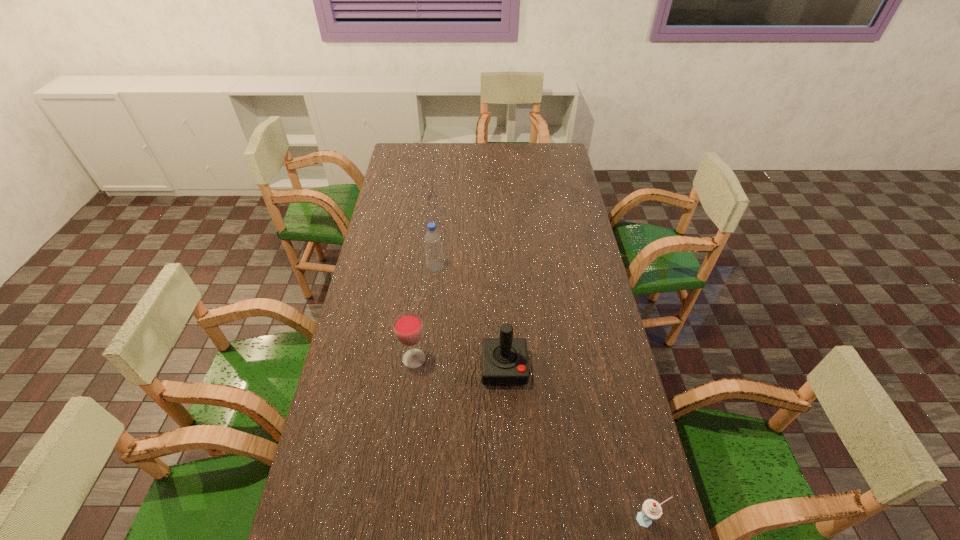
This screenshot has height=540, width=960. In order to click on vacant space at the left edge of the desktop in this screenshot , I will do coord(411,186).

In the image, there is a desktop. Where is `vacant region at the right edge`? Image resolution: width=960 pixels, height=540 pixels. vacant region at the right edge is located at coordinates (555, 181).

At what (x,y) coordinates should I click in order to perform the action: click on vacant space at the far left corner of the desktop. Please return your answer as a coordinate pair (x, y). This screenshot has height=540, width=960. Looking at the image, I should click on (406, 150).

The image size is (960, 540). I want to click on free spot between the wineglass and the joystick, so click(x=459, y=363).

This screenshot has width=960, height=540. Identify the location of vacant space that is in between the bottle and the rightmost object. (541, 394).

Find the location of a particular element. This screenshot has height=540, width=960. free space between the joystick and the wineglass is located at coordinates (459, 363).

The image size is (960, 540). Find the location of `vacant area between the farthest object and the shortest object`. vacant area between the farthest object and the shortest object is located at coordinates (541, 394).

At what (x,y) coordinates should I click in order to perform the action: click on vacant region between the second object from right to left and the milkshake. Please return your answer as a coordinate pair (x, y). Looking at the image, I should click on (576, 443).

I want to click on free space between the second object from right to left and the rightmost object, so click(576, 443).

You are a GUI agent. You are given a task and a screenshot of the screen. Output one action in this format:
    pyautogui.click(x=<x>, y=<y>)
    Task: Click on the free space between the bottle and the nearest object
    
    Given the screenshot: What is the action you would take?
    pyautogui.click(x=541, y=394)